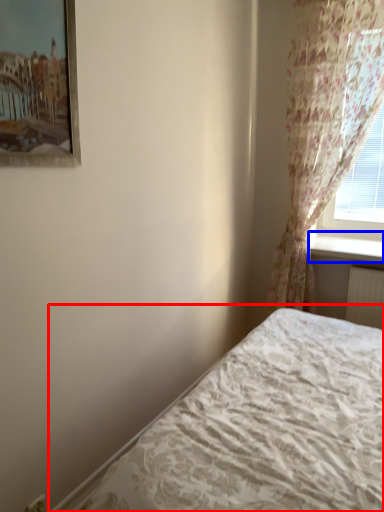
Question: Among these objects, which one is nearest to the camera, bed (highlighted by a red box) or window sill (highlighted by a blue box)?

Choices:
 (A) bed
 (B) window sill

Answer: (A)